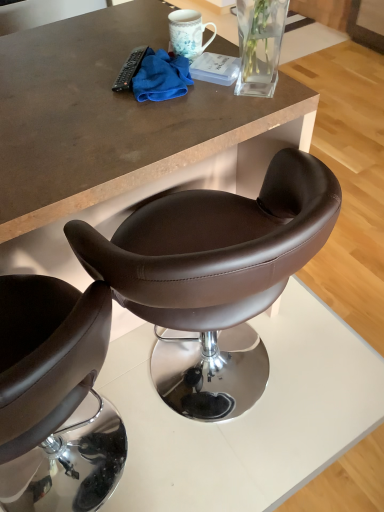
You are a GUI agent. You are given a task and a screenshot of the screen. Output one action in this format:
    pyautogui.click(x=<x>, y=<y>)
    Task: Click on the free location to the left of black plastic remote control at upper center
    The width and height of the screenshot is (384, 512).
    Given the screenshot: What is the action you would take?
    pyautogui.click(x=68, y=79)